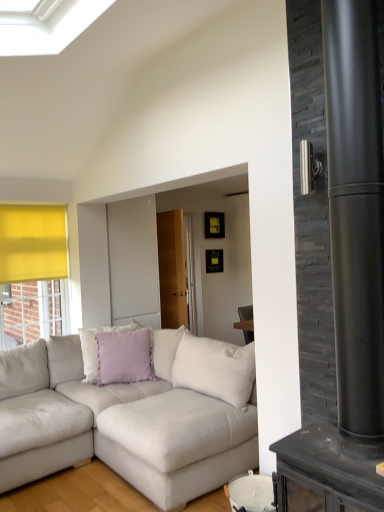
Question: Considering the relative sizes of matte black fireplace at right and light gray fabric couch at lower left in the image provided, is matte black fireplace at right taller than light gray fabric couch at lower left?

Choices:
 (A) no
 (B) yes

Answer: (B)

Question: Is matte black fireplace at right positioned behind light gray fabric couch at lower left?

Choices:
 (A) yes
 (B) no

Answer: (B)

Question: Does matte black fireplace at right appear on the right side of light gray fabric couch at lower left?

Choices:
 (A) yes
 (B) no

Answer: (A)

Question: Can you confirm if matte black fireplace at right is thinner than light gray fabric couch at lower left?

Choices:
 (A) yes
 (B) no

Answer: (A)

Question: Is matte black fireplace at right beside light gray fabric couch at lower left?

Choices:
 (A) yes
 (B) no

Answer: (B)

Question: Relative to light gray fabric couch at lower left, is matte black fireplace at right in front or behind?

Choices:
 (A) front
 (B) behind

Answer: (A)

Question: Is matte black fireplace at right bigger or smaller than light gray fabric couch at lower left?

Choices:
 (A) big
 (B) small

Answer: (B)

Question: Is point (344, 124) closer or farther from the camera than point (26, 373)?

Choices:
 (A) farther
 (B) closer

Answer: (B)

Question: From their relative heights in the image, would you say matte black fireplace at right is taller or shorter than light gray fabric couch at lower left?

Choices:
 (A) tall
 (B) short

Answer: (A)

Question: From the image's perspective, is light gray fabric couch at lower left located above or below lavender fabric pillow at center?

Choices:
 (A) below
 (B) above

Answer: (A)

Question: Considering the relative positions of light gray fabric couch at lower left and lavender fabric pillow at center in the image provided, is light gray fabric couch at lower left to the left or to the right of lavender fabric pillow at center?

Choices:
 (A) right
 (B) left

Answer: (B)

Question: Considering their positions, is light gray fabric couch at lower left located in front of or behind lavender fabric pillow at center?

Choices:
 (A) front
 (B) behind

Answer: (A)

Question: Does point (9, 454) appear closer or farther from the camera than point (100, 356)?

Choices:
 (A) farther
 (B) closer

Answer: (B)

Question: Relative to lavender fabric pillow at center, is matte black fireplace at right in front or behind?

Choices:
 (A) behind
 (B) front

Answer: (B)

Question: From a real-world perspective, is matte black fireplace at right above or below lavender fabric pillow at center?

Choices:
 (A) below
 (B) above

Answer: (B)